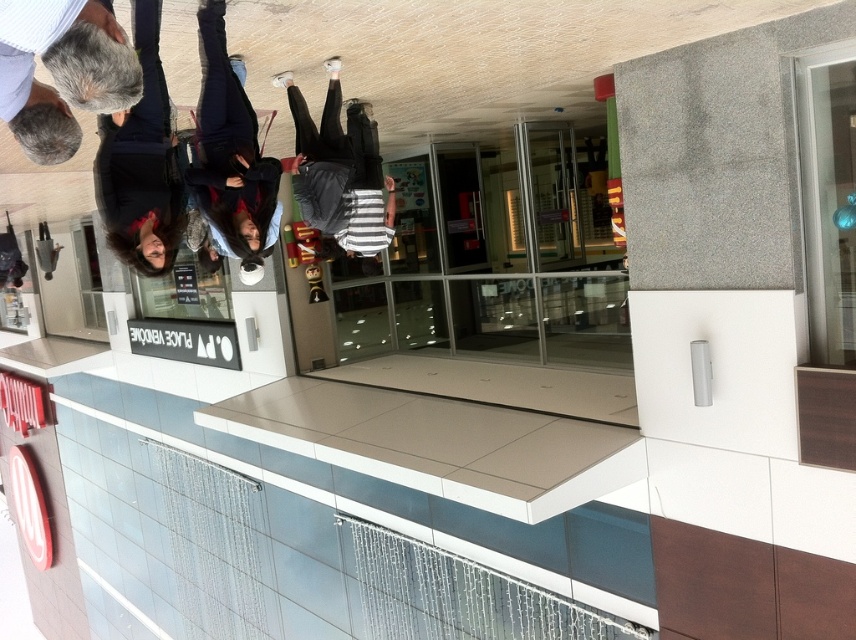
Question: Estimate the real-world distances between objects in this image. Which object is farther from the black matte pants at center?

Choices:
 (A) dark blue jeans at center
 (B) gray wool sweater at upper left
 (C) dark brown leather jacket at upper left

Answer: (B)

Question: Can you confirm if gray wool sweater at upper left is positioned to the left of black matte pants at center?

Choices:
 (A) yes
 (B) no

Answer: (A)

Question: Which object appears farthest from the camera in this image?

Choices:
 (A) dark brown leather jacket at upper left
 (B) gray wool sweater at upper left
 (C) black matte pants at center

Answer: (C)

Question: Is dark brown leather jacket at upper left wider than dark blue jeans at center?

Choices:
 (A) yes
 (B) no

Answer: (A)

Question: Which object is farther from the camera taking this photo?

Choices:
 (A) gray wool sweater at upper left
 (B) black matte pants at center
 (C) dark brown leather jacket at upper left
 (D) dark blue jeans at center

Answer: (B)

Question: Can you confirm if gray wool sweater at upper left is positioned above dark blue jeans at center?

Choices:
 (A) yes
 (B) no

Answer: (B)